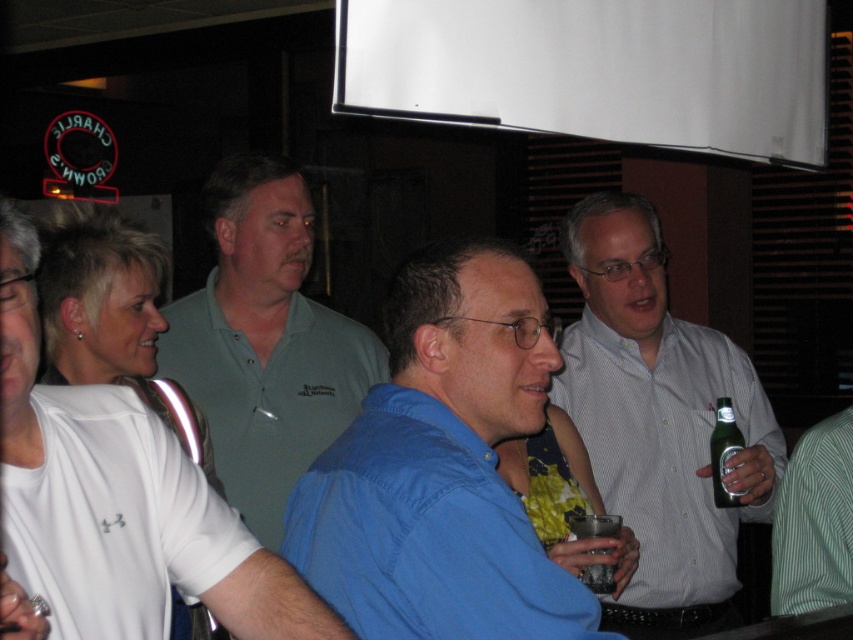
Between white matte polo shirt at left and clear plastic cup at center, which one is positioned lower?

clear plastic cup at center

Does point (207, 541) lie in front of point (598, 566)?

Yes.

This screenshot has height=640, width=853. I want to click on white matte polo shirt at left, so click(x=113, y=516).

Find the location of a particular element. The height and width of the screenshot is (640, 853). white matte polo shirt at left is located at coordinates (113, 516).

Can you confirm if white matte polo shirt at upper left is bigger than green glass bottle at right?

Indeed, white matte polo shirt at upper left has a larger size compared to green glass bottle at right.

Where is `white matte polo shirt at upper left`? white matte polo shirt at upper left is located at coordinates (125, 499).

What do you see at coordinates (125, 499) in the screenshot? The height and width of the screenshot is (640, 853). I see `white matte polo shirt at upper left` at bounding box center [125, 499].

Does white matte polo shirt at upper left have a smaller size compared to matte green polo shirt at center?

Yes, white matte polo shirt at upper left is smaller than matte green polo shirt at center.

Is point (44, 532) less distant than point (339, 384)?

Yes.

You are a GUI agent. You are given a task and a screenshot of the screen. Output one action in this format:
    pyautogui.click(x=<x>, y=<y>)
    Task: Click on the white matte polo shirt at upper left
    The width and height of the screenshot is (853, 640).
    Given the screenshot: What is the action you would take?
    pyautogui.click(x=125, y=499)